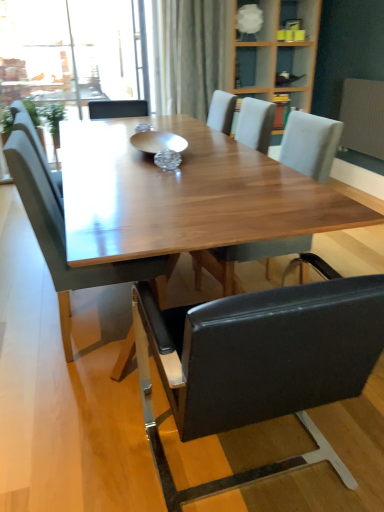
Describe the element at coordinates (363, 117) in the screenshot. I see `white textured radiator at right` at that location.

In the scene shown: What is the approximate height of light gray fabric chair at center, the third chair positioned from the left?

36.19 centimeters.

At what (x,y) coordinates should I click in order to perform the action: click on white textured radiator at right. Please return your answer as a coordinate pair (x, y). The image size is (384, 512). Looking at the image, I should click on (363, 117).

Does gold metallic bowl at center have a lesser height compared to light gray fabric chair at center, the third chair positioned from the left?

Indeed, gold metallic bowl at center has a lesser height compared to light gray fabric chair at center, the third chair positioned from the left.

Considering the sizes of objects gold metallic bowl at center and light gray fabric chair at center, which is the first chair from right to left, in the image provided, who is smaller, gold metallic bowl at center or light gray fabric chair at center, which is the first chair from right to left,?

gold metallic bowl at center.

Which of these two, gold metallic bowl at center or light gray fabric chair at center, which is the first chair from right to left, is thinner?

gold metallic bowl at center.

Consider the image. Does gold metallic bowl at center contain light gray fabric chair at center, which is the first chair from right to left?

No, light gray fabric chair at center, which is the first chair from right to left, is not inside gold metallic bowl at center.

Is leather-like black chair at center, the second chair in the left-to-right sequence, in front of or behind light gray fabric chair at center, the third chair positioned from the left, in the image?

Visually, leather-like black chair at center, the second chair in the left-to-right sequence, is located in front of light gray fabric chair at center, the third chair positioned from the left.

Consider the image. Is light gray fabric chair at center, the third chair positioned from the left, located within leather-like black chair at center, the second chair in the left-to-right sequence?

That's incorrect, light gray fabric chair at center, the third chair positioned from the left, is not inside leather-like black chair at center, the second chair in the left-to-right sequence.

Is leather-like black chair at center, the 2th chair from the right, bigger than light gray fabric chair at center, which is the first chair from right to left?

Yes, leather-like black chair at center, the 2th chair from the right, is bigger than light gray fabric chair at center, which is the first chair from right to left.

From a real-world perspective, which object rests below the other?

In real-world perspective, matte gray chair at left, which appears as the 3th chair when viewed from the right, is lower.

In order to click on chair behind the matte gray chair at left, which is the 1th chair in left-to-right order in this screenshot , I will do `click(310, 144)`.

Considering the relative sizes of light gray fabric chair at center, which is the first chair from right to left, and matte gray chair at left, which appears as the 3th chair when viewed from the right, in the image provided, is light gray fabric chair at center, which is the first chair from right to left, wider than matte gray chair at left, which appears as the 3th chair when viewed from the right,?

In fact, light gray fabric chair at center, which is the first chair from right to left, might be narrower than matte gray chair at left, which appears as the 3th chair when viewed from the right.

Is light gray fabric chair at center, the third chair positioned from the left, bigger or smaller than matte gray chair at left, which is the 1th chair in left-to-right order?

In the image, light gray fabric chair at center, the third chair positioned from the left, appears to be smaller than matte gray chair at left, which is the 1th chair in left-to-right order.

Is leather-like black chair at center, the 2th chair from the right, inside the boundaries of gold metallic bowl at center, or outside?

leather-like black chair at center, the 2th chair from the right, is located beyond the bounds of gold metallic bowl at center.

From the image's perspective, which one is positioned lower, leather-like black chair at center, the 2th chair from the right, or gold metallic bowl at center?

leather-like black chair at center, the 2th chair from the right.

Based on the photo, can you confirm if leather-like black chair at center, the second chair in the left-to-right sequence, is positioned to the left of gold metallic bowl at center?

No, leather-like black chair at center, the second chair in the left-to-right sequence, is not to the left of gold metallic bowl at center.

Which object is wider, leather-like black chair at center, the 2th chair from the right, or gold metallic bowl at center?

With larger width is leather-like black chair at center, the 2th chair from the right.

Considering the relative positions of gold metallic bowl at center and white textured radiator at right in the image provided, is gold metallic bowl at center to the left or to the right of white textured radiator at right?

gold metallic bowl at center is to the left of white textured radiator at right.

Which object is closer to the camera taking this photo, gold metallic bowl at center or white textured radiator at right?

gold metallic bowl at center is more forward.

How far apart are gold metallic bowl at center and white textured radiator at right?

They are 2.08 meters apart.

Is gold metallic bowl at center facing away from white textured radiator at right?

No, white textured radiator at right is not at the back of gold metallic bowl at center.

Looking at this image, is matte gray chair at left, which is the 1th chair in left-to-right order, touching gold metallic bowl at center?

matte gray chair at left, which is the 1th chair in left-to-right order, and gold metallic bowl at center are clearly separated.

In order to click on chair on the left of the gold metallic bowl at center in this screenshot , I will do `click(64, 236)`.

From the image's perspective, is matte gray chair at left, which is the 1th chair in left-to-right order, located beneath gold metallic bowl at center?

Correct, matte gray chair at left, which is the 1th chair in left-to-right order, appears lower than gold metallic bowl at center in the image.

Considering the positions of objects leather-like black chair at center, the second chair in the left-to-right sequence, and matte gray chair at left, which appears as the 3th chair when viewed from the right, in the image provided, who is behind, leather-like black chair at center, the second chair in the left-to-right sequence, or matte gray chair at left, which appears as the 3th chair when viewed from the right,?

Positioned behind is matte gray chair at left, which appears as the 3th chair when viewed from the right.

Is leather-like black chair at center, the 2th chair from the right, positioned with its back to matte gray chair at left, which is the 1th chair in left-to-right order?

That's not correct — leather-like black chair at center, the 2th chair from the right, is not looking away from matte gray chair at left, which is the 1th chair in left-to-right order.

From the image's perspective, which object appears higher, leather-like black chair at center, the 2th chair from the right, or matte gray chair at left, which appears as the 3th chair when viewed from the right?

matte gray chair at left, which appears as the 3th chair when viewed from the right, from the image's perspective.

From a real-world perspective, is leather-like black chair at center, the 2th chair from the right, beneath matte gray chair at left, which appears as the 3th chair when viewed from the right?

Indeed, from a real-world perspective, leather-like black chair at center, the 2th chair from the right, is positioned beneath matte gray chair at left, which appears as the 3th chair when viewed from the right.

Identify the location of bowl behind the light gray fabric chair at center, which is the first chair from right to left. (158, 142).

Identify the location of the 2nd chair above when counting from the leather-like black chair at center, the second chair in the left-to-right sequence (from the image's perspective). click(x=310, y=144).

When comparing their distances from white textured radiator at right, does leather-like black chair at center, the second chair in the left-to-right sequence, or white frosted glass lampshade at upper center seem closer?

white frosted glass lampshade at upper center.

Estimate the real-world distances between objects in this image. Which object is further from white frosted glass lampshade at upper center, light gray fabric chair at center, which is the first chair from right to left, or white textured radiator at right?

Among the two, light gray fabric chair at center, which is the first chair from right to left, is located further to white frosted glass lampshade at upper center.

From the image, which object appears to be nearer to leather-like black chair at center, the 2th chair from the right, matte gray chair at left, which appears as the 3th chair when viewed from the right, or light gray fabric chair at center, which is the first chair from right to left?

The object closer to leather-like black chair at center, the 2th chair from the right, is matte gray chair at left, which appears as the 3th chair when viewed from the right.

When comparing their distances from matte gray chair at left, which is the 1th chair in left-to-right order, does gold metallic bowl at center or leather-like black chair at center, the second chair in the left-to-right sequence, seem further?

gold metallic bowl at center lies further to matte gray chair at left, which is the 1th chair in left-to-right order, than the other object.

Considering their positions, is white textured radiator at right positioned closer to white frosted glass lampshade at upper center than matte gray chair at left, which appears as the 3th chair when viewed from the right?

Among the two, white textured radiator at right is located nearer to white frosted glass lampshade at upper center.

Considering their positions, is leather-like black chair at center, the second chair in the left-to-right sequence, positioned closer to white frosted glass lampshade at upper center than gold metallic bowl at center?

gold metallic bowl at center lies closer to white frosted glass lampshade at upper center than the other object.

Based on their spatial positions, is white textured radiator at right or white frosted glass lampshade at upper center closer to gold metallic bowl at center?

Among the two, white textured radiator at right is located nearer to gold metallic bowl at center.

Considering their positions, is gold metallic bowl at center positioned closer to light gray fabric chair at center, the third chair positioned from the left, than matte gray chair at left, which is the 1th chair in left-to-right order?

gold metallic bowl at center is positioned closer to the anchor light gray fabric chair at center, the third chair positioned from the left.

The width and height of the screenshot is (384, 512). What are the coordinates of `radiator between leather-like black chair at center, the second chair in the left-to-right sequence, and white frosted glass lampshade at upper center, along the z-axis` in the screenshot? It's located at (363, 117).

You are a GUI agent. You are given a task and a screenshot of the screen. Output one action in this format:
    pyautogui.click(x=<x>, y=<y>)
    Task: Click on the bowl between leather-like black chair at center, the 2th chair from the right, and white frosted glass lampshade at upper center from front to back
    
    Given the screenshot: What is the action you would take?
    pyautogui.click(x=158, y=142)

Locate an element on the screen. This screenshot has width=384, height=512. radiator positioned between matte gray chair at left, which is the 1th chair in left-to-right order, and white frosted glass lampshade at upper center from near to far is located at coordinates (363, 117).

Identify the location of chair between leather-like black chair at center, the 2th chair from the right, and light gray fabric chair at center, which is the first chair from right to left, along the z-axis. (64, 236).